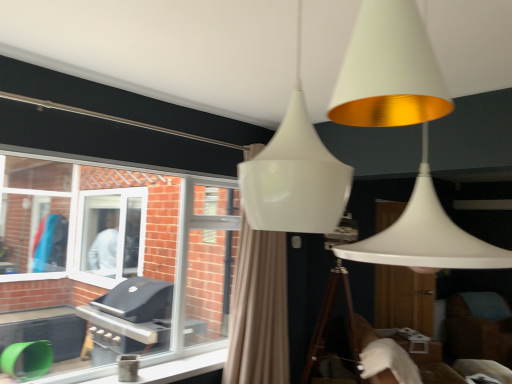
Question: In terms of size, does clear glass window at left appear bigger or smaller than brown fabric swivel chair at lower right?

Choices:
 (A) small
 (B) big

Answer: (A)

Question: Visually, is clear glass window at left positioned to the left or to the right of brown fabric swivel chair at lower right?

Choices:
 (A) left
 (B) right

Answer: (A)

Question: Which object is the closest to the brown fabric swivel chair at lower right?

Choices:
 (A) beige fabric curtain at center
 (B) clear glass window at left

Answer: (A)

Question: Which of these objects is positioned closest to the beige fabric curtain at center?

Choices:
 (A) brown fabric swivel chair at lower right
 (B) clear glass window at left

Answer: (B)